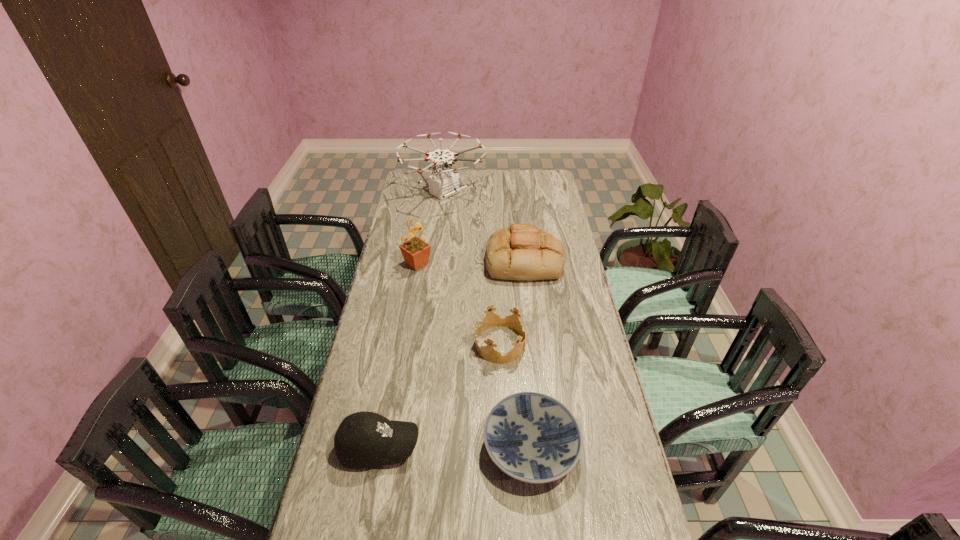
This screenshot has height=540, width=960. I want to click on plate situated at the right edge, so click(534, 438).

Locate an element on the screen. The image size is (960, 540). object at the far left corner is located at coordinates (444, 182).

In the image, there is a desktop. Where is `blank space at the far edge`? This screenshot has width=960, height=540. blank space at the far edge is located at coordinates pos(474,171).

Find the location of a particular element. Image resolution: width=960 pixels, height=540 pixels. vacant area at the left edge is located at coordinates (375, 397).

The image size is (960, 540). In the image, there is a desktop. In order to click on vacant area at the right edge in this screenshot , I will do `click(560, 373)`.

This screenshot has width=960, height=540. What are the coordinates of `vacant space at the far right corner of the desktop` in the screenshot? It's located at (552, 177).

The height and width of the screenshot is (540, 960). What are the coordinates of `unoccupied area between the sunflower and the fourth shortest object` in the screenshot? It's located at (470, 262).

Find the location of a particular element. empty location between the sunflower and the plate is located at coordinates (474, 355).

Where is `vacant region between the tiara and the tallest object`? The width and height of the screenshot is (960, 540). vacant region between the tiara and the tallest object is located at coordinates (472, 268).

This screenshot has height=540, width=960. What are the coordinates of `free space between the baseball cap and the plate` in the screenshot? It's located at (455, 447).